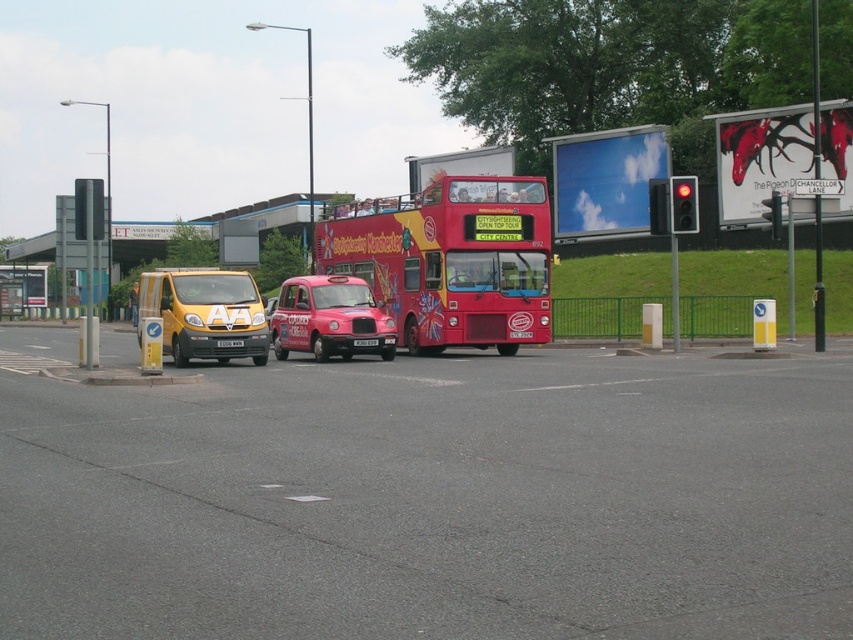
Question: Among these points, which one is nearest to the camera?

Choices:
 (A) (149, 289)
 (B) (363, 212)
 (C) (277, 304)
 (D) (236, 340)

Answer: (D)

Question: Which object is positioned closest to the yellow matte van at left?

Choices:
 (A) matte red taxi at center
 (B) black plastic license plate at center

Answer: (A)

Question: Among these objects, which one is nearest to the camera?

Choices:
 (A) matte red taxi at center
 (B) white plastic license plate at center
 (C) yellow matte van at left

Answer: (C)

Question: In this image, where is shiny red double-decker bus at center located relative to white plastic license plate at center?

Choices:
 (A) below
 (B) above

Answer: (B)

Question: Can you confirm if matte red taxi at center is positioned above white plastic license plate at center?

Choices:
 (A) no
 (B) yes

Answer: (B)

Question: In this image, where is yellow matte van at left located relative to matte red taxi at center?

Choices:
 (A) below
 (B) above

Answer: (B)